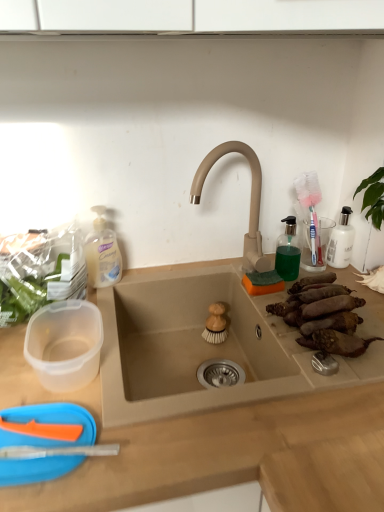
Question: Considering the relative positions of beige matte faucet at center and beige matte sink at center in the image provided, is beige matte faucet at center to the right of beige matte sink at center from the viewer's perspective?

Choices:
 (A) no
 (B) yes

Answer: (A)

Question: Can you confirm if beige matte faucet at center is bigger than beige matte sink at center?

Choices:
 (A) yes
 (B) no

Answer: (B)

Question: Considering the relative sizes of beige matte faucet at center and beige matte sink at center in the image provided, is beige matte faucet at center taller than beige matte sink at center?

Choices:
 (A) no
 (B) yes

Answer: (B)

Question: From the image's perspective, would you say beige matte faucet at center is shown under beige matte sink at center?

Choices:
 (A) no
 (B) yes

Answer: (A)

Question: Is the position of beige matte faucet at center less distant than that of beige matte sink at center?

Choices:
 (A) no
 (B) yes

Answer: (A)

Question: Looking at their shapes, would you say brown rough sweet potatoes at right sink, the first food from the right, is wider or thinner than translucent plastic soap dispenser at left?

Choices:
 (A) wide
 (B) thin

Answer: (A)

Question: Is point (294, 301) closer or farther from the camera than point (117, 244)?

Choices:
 (A) farther
 (B) closer

Answer: (B)

Question: From a real-world perspective, is brown rough sweet potatoes at right sink, arranged as the first food when viewed from the front, physically located above or below translucent plastic soap dispenser at left?

Choices:
 (A) above
 (B) below

Answer: (B)

Question: Relative to translucent plastic soap dispenser at left, is brown rough sweet potatoes at right sink, arranged as the first food when viewed from the front, in front or behind?

Choices:
 (A) front
 (B) behind

Answer: (A)

Question: Considering the relative positions of brown rough sweet potatoes at right sink, arranged as the first food when viewed from the front, and wooden brush at sink, which ranks as the 1th food in back-to-front order, in the image provided, is brown rough sweet potatoes at right sink, arranged as the first food when viewed from the front, to the left or to the right of wooden brush at sink, which ranks as the 1th food in back-to-front order,?

Choices:
 (A) right
 (B) left

Answer: (A)

Question: Considering the positions of brown rough sweet potatoes at right sink, acting as the second food starting from the left, and wooden brush at sink, which ranks as the 1th food in back-to-front order, in the image, is brown rough sweet potatoes at right sink, acting as the second food starting from the left, wider or thinner than wooden brush at sink, which ranks as the 1th food in back-to-front order,?

Choices:
 (A) thin
 (B) wide

Answer: (B)

Question: From the image's perspective, is brown rough sweet potatoes at right sink, the 2th food positioned from the back, located above or below wooden brush at sink, arranged as the 1th food when viewed from the left?

Choices:
 (A) above
 (B) below

Answer: (A)

Question: Is brown rough sweet potatoes at right sink, arranged as the first food when viewed from the front, taller or shorter than wooden brush at sink, the second food when ordered from front to back?

Choices:
 (A) short
 (B) tall

Answer: (A)

Question: Considering the positions of translucent plastic soap dispenser at left and transparent plastic soap dispenser at upper right in the image, is translucent plastic soap dispenser at left bigger or smaller than transparent plastic soap dispenser at upper right?

Choices:
 (A) big
 (B) small

Answer: (A)

Question: In terms of width, does translucent plastic soap dispenser at left look wider or thinner when compared to transparent plastic soap dispenser at upper right?

Choices:
 (A) thin
 (B) wide

Answer: (B)